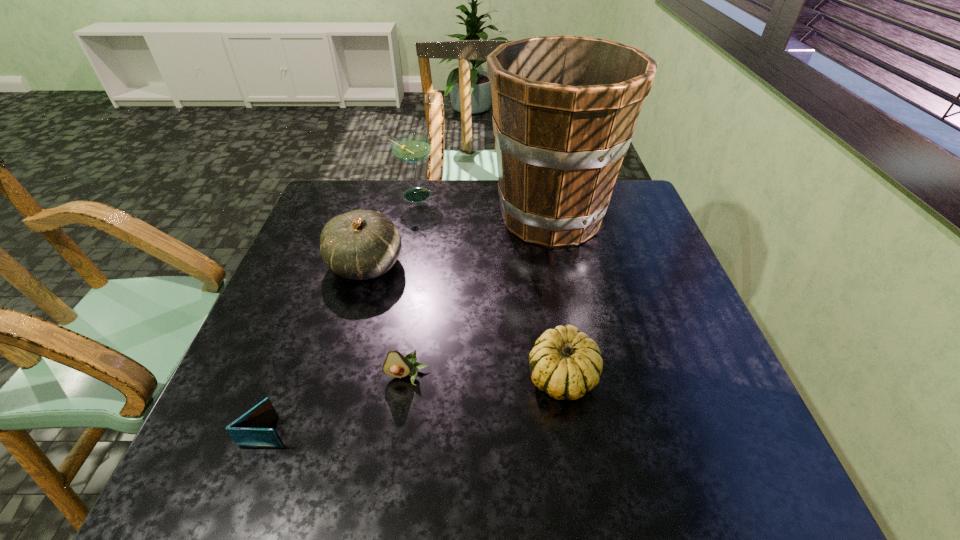
Where is `object that is the fourth closest to the fourth tallest object`? object that is the fourth closest to the fourth tallest object is located at coordinates (250, 430).

You are a GUI agent. You are given a task and a screenshot of the screen. Output one action in this format:
    pyautogui.click(x=<x>, y=<y>)
    Task: Click on the vacant region that satisfies the following two spatial constraints: 1. on the front side of the fifth shortest object; 2. on the right side of the bucket
    The width and height of the screenshot is (960, 540).
    Given the screenshot: What is the action you would take?
    pyautogui.click(x=411, y=217)

Locate an element on the screen. The image size is (960, 540). free spot that satisfies the following two spatial constraints: 1. on the seed side of the avocado; 2. on the right side of the shorter gourd is located at coordinates (407, 377).

Find the location of a particular element. vacant area in the image that satisfies the following two spatial constraints: 1. on the front side of the shorter gourd; 2. on the exterior surface of the wallet is located at coordinates (571, 431).

Locate an element on the screen. This screenshot has height=540, width=960. free location that satisfies the following two spatial constraints: 1. on the back side of the bucket; 2. on the right side of the right gourd is located at coordinates (537, 217).